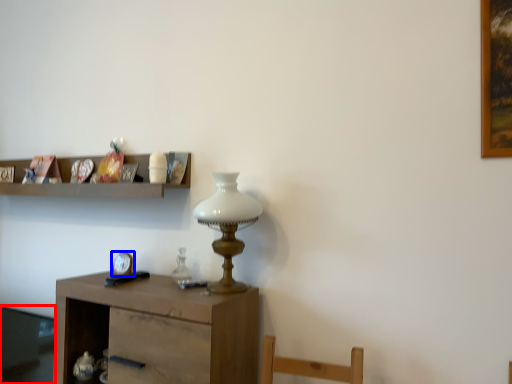
Question: Which object appears farthest to the camera in this image, glass table (highlighted by a red box) or clock (highlighted by a blue box)?

Choices:
 (A) glass table
 (B) clock

Answer: (A)